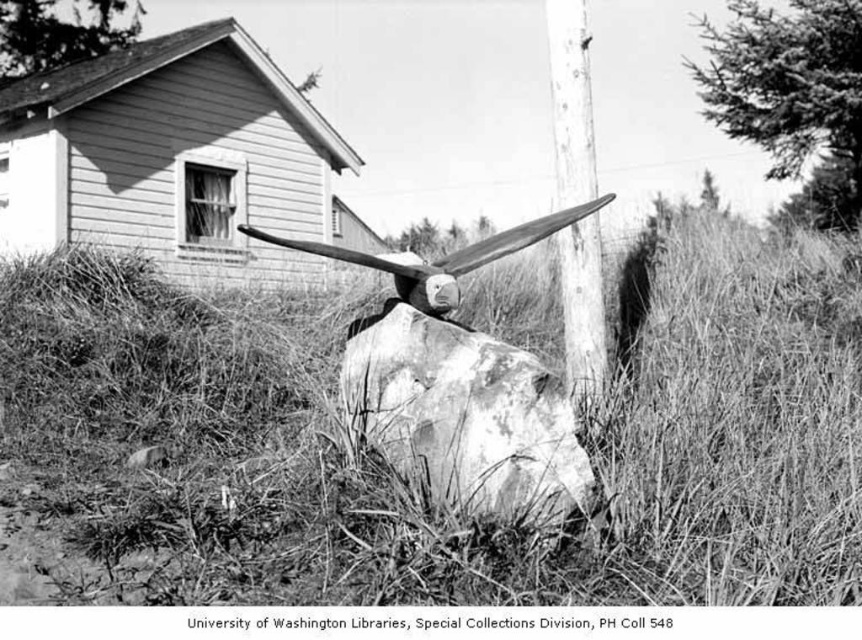
You are a photographer standing in the rural scene described. You notice the dry grass at center and the wooden propeller at center. From your position, which object is closer to your right side?

The dry grass at center is to the right of wooden propeller at center, so the dry grass at center is closer to your right side.